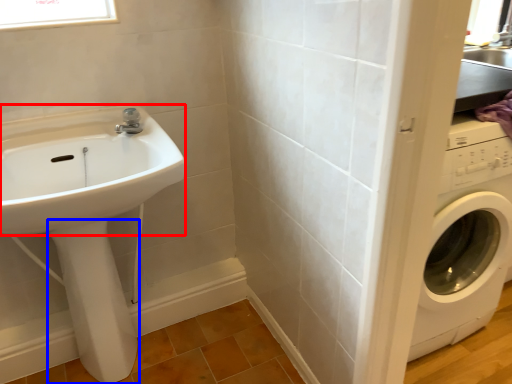
Question: Which point is further to the camera, sink (highlighted by a red box) or bidet (highlighted by a blue box)?

Choices:
 (A) sink
 (B) bidet

Answer: (B)